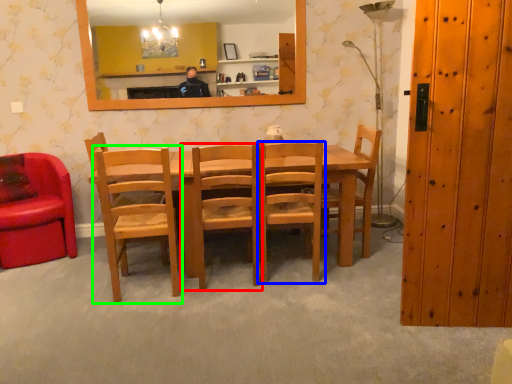
Question: Based on their relative distances, which object is farther from chair (highlighted by a red box)? Choose from chair (highlighted by a blue box) and chair (highlighted by a green box).

Choices:
 (A) chair
 (B) chair

Answer: (B)